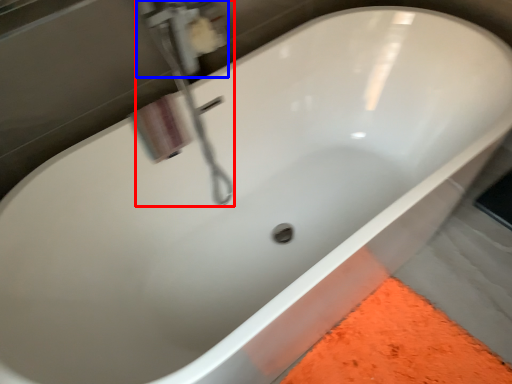
Question: Which point is closer to the camera, plumbing fixture (highlighted by a red box) or plumbing fixture (highlighted by a blue box)?

Choices:
 (A) plumbing fixture
 (B) plumbing fixture

Answer: (A)